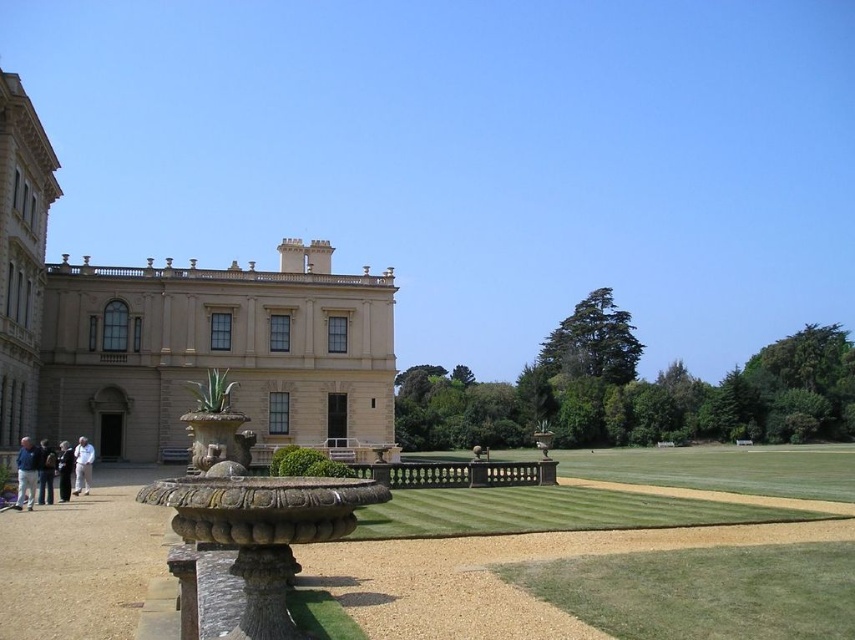
You are standing on the gravel pathway near the beige stone palace at left and dark blue jeans at lower left. Which object would you have to look up more to see properly?

The beige stone palace at left is much taller than the dark blue jeans at lower left, so you would have to look up more to see the beige stone palace at left properly.

Based on the photo, you are standing on the gravel pathway near the ornamental fountain and see the light blue denim jacket at lower left and dark blue jeans at lower left. Which item is placed higher up?

The light blue denim jacket at lower left is positioned over dark blue jeans at lower left, so the jacket is higher up.

You are standing on the gravel pathway near the ornamental fountain in the center. You want to walk towards the beige stone palace at left. Which direction should you head relative to the dark blue jeans at lower left?

You should head to the right side of the dark blue jeans at lower left because the beige stone palace at left is positioned on the right side of dark blue jeans at lower left.